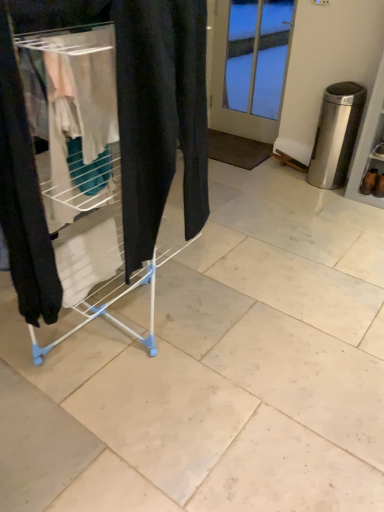
In order to click on free space between white plastic drying rack at left and brown suede boot at lower right, which is counted as the first footwear, starting from the left in this screenshot , I will do `click(263, 246)`.